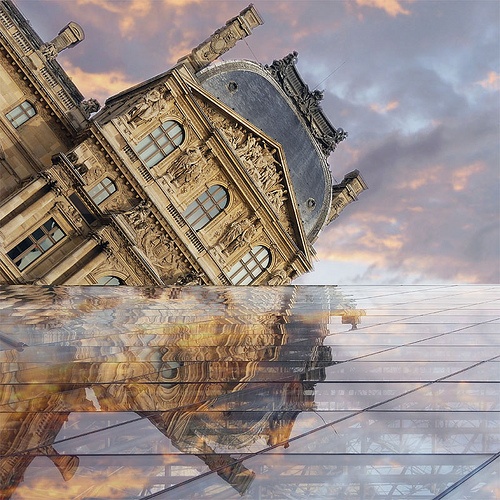
Locate an element on the screen. pillars is located at coordinates (224, 39), (345, 196).